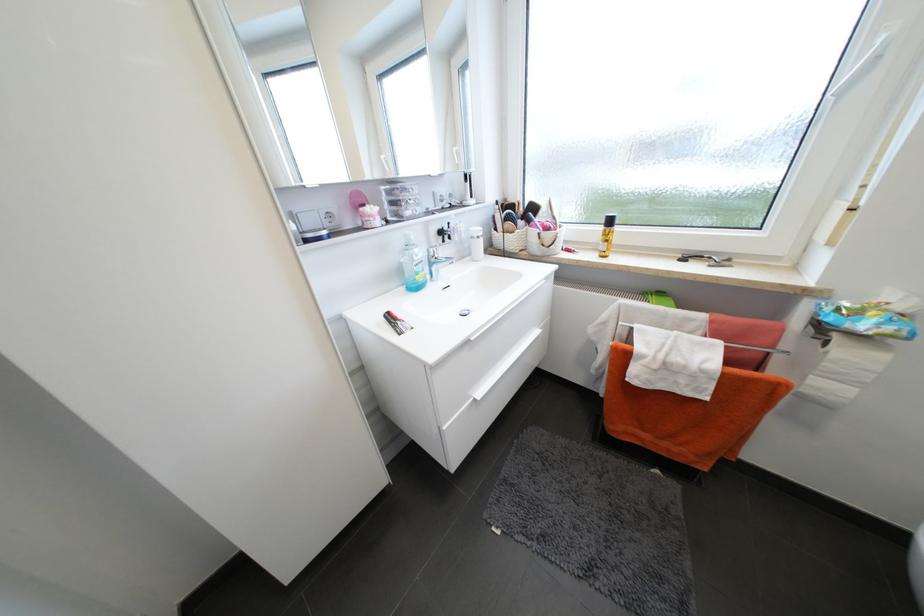
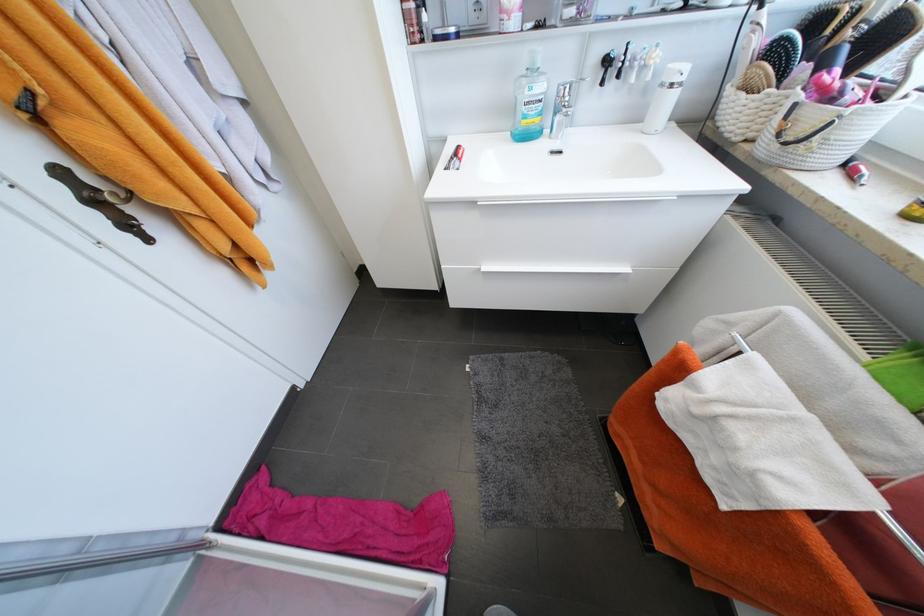
Locate, in the second image, the point that corresponds to pixel 478 238 in the first image.

(667, 86)